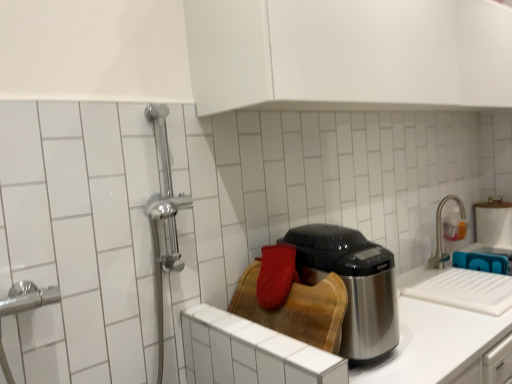
You are a GUI agent. You are given a task and a screenshot of the screen. Output one action in this format:
    pyautogui.click(x=<x>, y=<y>)
    Task: Click on the free space above satin steel counter top at center (from a real-world perspective)
    
    Given the screenshot: What is the action you would take?
    pyautogui.click(x=466, y=298)